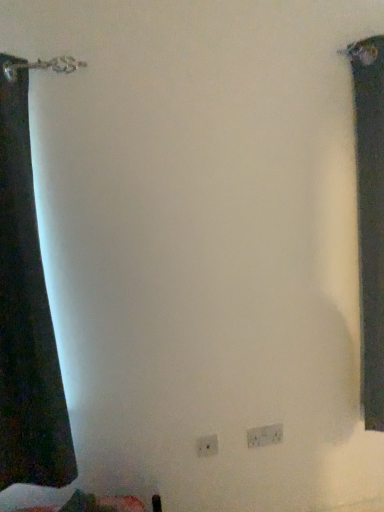
This screenshot has height=512, width=384. Describe the element at coordinates (370, 219) in the screenshot. I see `dark fabric curtain at right` at that location.

What do you see at coordinates (207, 445) in the screenshot?
I see `white plastic electric outlet at lower center, the first electric outlet from the front` at bounding box center [207, 445].

Identify the location of white plastic electric outlet at lower center, the second electric outlet in the right-to-left sequence. Image resolution: width=384 pixels, height=512 pixels. (207, 445).

This screenshot has height=512, width=384. I want to click on white plastic electric outlet at lower center, placed as the 2th electric outlet when sorted from left to right, so click(265, 435).

This screenshot has width=384, height=512. I want to click on dark fabric curtain at right, so click(370, 219).

From a real-world perspective, is white plastic electric outlet at lower center, the second electric outlet in the right-to-left sequence, on top of white plastic electric outlet at lower center, placed as the 2th electric outlet when sorted from left to right?

Yes, from a real-world perspective, white plastic electric outlet at lower center, the second electric outlet in the right-to-left sequence, is over white plastic electric outlet at lower center, placed as the 2th electric outlet when sorted from left to right

Which is closer, (201, 452) or (263, 432)?

The point (201, 452) is in front.

From the image's perspective, between white plastic electric outlet at lower center, which is the second electric outlet in back-to-front order, and white plastic electric outlet at lower center, which is counted as the first electric outlet, starting from the right, who is located below?

From the image's view, white plastic electric outlet at lower center, which is the second electric outlet in back-to-front order, is below.

What's the angular difference between white plastic electric outlet at lower center, placed as the 2th electric outlet when sorted from left to right, and dark fabric curtain at right's facing directions?

There is a 0.103-degree angle between the facing directions of white plastic electric outlet at lower center, placed as the 2th electric outlet when sorted from left to right, and dark fabric curtain at right.

Which is behind, point (280, 428) or point (381, 428)?

Positioned behind is point (381, 428).

From the image's perspective, is white plastic electric outlet at lower center, which ranks as the 1th electric outlet in back-to-front order, on top of dark fabric curtain at right?

No, from the image's perspective, white plastic electric outlet at lower center, which ranks as the 1th electric outlet in back-to-front order, is not above dark fabric curtain at right.

Is white plastic electric outlet at lower center, which ranks as the 1th electric outlet in back-to-front order, inside or outside of dark fabric curtain at right?

white plastic electric outlet at lower center, which ranks as the 1th electric outlet in back-to-front order, cannot be found inside dark fabric curtain at right.

You are a GUI agent. You are given a task and a screenshot of the screen. Output one action in this format:
    pyautogui.click(x=<x>, y=<y>)
    Task: Click on the electric outlet lying behind the white plastic electric outlet at lower center, which is the second electric outlet in back-to-front order
    The height and width of the screenshot is (512, 384).
    Given the screenshot: What is the action you would take?
    pyautogui.click(x=265, y=435)

Is white plastic electric outlet at lower center, which is counted as the first electric outlet, starting from the right, not close to white plastic electric outlet at lower center, which is the second electric outlet in back-to-front order?

No, there isn't a large distance between white plastic electric outlet at lower center, which is counted as the first electric outlet, starting from the right, and white plastic electric outlet at lower center, which is the second electric outlet in back-to-front order.

Looking at their sizes, would you say white plastic electric outlet at lower center, which is counted as the 2th electric outlet, starting from the front, is wider or thinner than white plastic electric outlet at lower center, the second electric outlet in the right-to-left sequence?

In the image, white plastic electric outlet at lower center, which is counted as the 2th electric outlet, starting from the front, appears to be wider than white plastic electric outlet at lower center, the second electric outlet in the right-to-left sequence.

Is white plastic electric outlet at lower center, placed as the 2th electric outlet when sorted from left to right, smaller than white plastic electric outlet at lower center, the second electric outlet in the right-to-left sequence?

No.

Considering the positions of point (204, 454) and point (367, 193), is point (204, 454) closer or farther from the camera than point (367, 193)?

Point (204, 454) is positioned farther from the camera compared to point (367, 193).

From the image's perspective, is white plastic electric outlet at lower center, the second electric outlet in the right-to-left sequence, under dark fabric curtain at right?

Correct, white plastic electric outlet at lower center, the second electric outlet in the right-to-left sequence, appears lower than dark fabric curtain at right in the image.

Is white plastic electric outlet at lower center, which is the second electric outlet in back-to-front order, taller or shorter than dark fabric curtain at right?

In the image, white plastic electric outlet at lower center, which is the second electric outlet in back-to-front order, appears to be shorter than dark fabric curtain at right.

From the picture: Considering the relative positions of white plastic electric outlet at lower center, the 1th electric outlet when ordered from left to right, and dark fabric curtain at right in the image provided, is white plastic electric outlet at lower center, the 1th electric outlet when ordered from left to right, to the right of dark fabric curtain at right from the viewer's perspective?

In fact, white plastic electric outlet at lower center, the 1th electric outlet when ordered from left to right, is to the left of dark fabric curtain at right.

Does dark fabric curtain at right have a greater height compared to white plastic electric outlet at lower center, which is the second electric outlet in back-to-front order?

Yes.

Considering the positions of objects dark fabric curtain at right and white plastic electric outlet at lower center, which is the second electric outlet in back-to-front order, in the image provided, who is more to the right, dark fabric curtain at right or white plastic electric outlet at lower center, which is the second electric outlet in back-to-front order,?

Positioned to the right is dark fabric curtain at right.

From a real-world perspective, is dark fabric curtain at right under white plastic electric outlet at lower center, which is the second electric outlet in back-to-front order?

No, from a real-world perspective, dark fabric curtain at right is not under white plastic electric outlet at lower center, which is the second electric outlet in back-to-front order.

Is white plastic electric outlet at lower center, the 1th electric outlet when ordered from left to right, a part of dark fabric curtain at right?

No, white plastic electric outlet at lower center, the 1th electric outlet when ordered from left to right, is not surrounded by dark fabric curtain at right.

Find the location of a particular element. The height and width of the screenshot is (512, 384). curtain that is in front of the white plastic electric outlet at lower center, which is counted as the 2th electric outlet, starting from the front is located at coordinates (370, 219).

Which is behind, point (366, 56) or point (257, 428)?

Positioned behind is point (257, 428).

Does dark fabric curtain at right touch white plastic electric outlet at lower center, placed as the 2th electric outlet when sorted from left to right?

dark fabric curtain at right and white plastic electric outlet at lower center, placed as the 2th electric outlet when sorted from left to right, are clearly separated.

Is dark fabric curtain at right not within white plastic electric outlet at lower center, which ranks as the 1th electric outlet in back-to-front order?

That's correct, dark fabric curtain at right is outside of white plastic electric outlet at lower center, which ranks as the 1th electric outlet in back-to-front order.

In the image, there is a white plastic electric outlet at lower center, the first electric outlet from the front. Where is `electric outlet below it (from a real-world perspective)`? This screenshot has width=384, height=512. electric outlet below it (from a real-world perspective) is located at coordinates (265, 435).

Image resolution: width=384 pixels, height=512 pixels. In order to click on the 2nd electric outlet behind the dark fabric curtain at right, counting from the anchor's position in this screenshot , I will do `click(265, 435)`.

Which object lies further to the anchor point dark fabric curtain at right, white plastic electric outlet at lower center, which is the second electric outlet in back-to-front order, or white plastic electric outlet at lower center, placed as the 2th electric outlet when sorted from left to right?

The object further to dark fabric curtain at right is white plastic electric outlet at lower center, which is the second electric outlet in back-to-front order.

In the scene shown: When comparing their distances from white plastic electric outlet at lower center, which is counted as the first electric outlet, starting from the right, does white plastic electric outlet at lower center, which is the second electric outlet in back-to-front order, or dark fabric curtain at right seem closer?

white plastic electric outlet at lower center, which is the second electric outlet in back-to-front order, is positioned closer to the anchor white plastic electric outlet at lower center, which is counted as the first electric outlet, starting from the right.

Based on their spatial positions, is dark fabric curtain at right or white plastic electric outlet at lower center, which is counted as the 2th electric outlet, starting from the front, closer to white plastic electric outlet at lower center, the second electric outlet in the right-to-left sequence?

The object closer to white plastic electric outlet at lower center, the second electric outlet in the right-to-left sequence, is white plastic electric outlet at lower center, which is counted as the 2th electric outlet, starting from the front.

Estimate the real-world distances between objects in this image. Which object is closer to white plastic electric outlet at lower center, which ranks as the 1th electric outlet in back-to-front order, dark fabric curtain at right or white plastic electric outlet at lower center, the first electric outlet from the front?

white plastic electric outlet at lower center, the first electric outlet from the front.

Estimate the real-world distances between objects in this image. Which object is closer to white plastic electric outlet at lower center, the first electric outlet from the front, white plastic electric outlet at lower center, which is counted as the 2th electric outlet, starting from the front, or dark fabric curtain at right?

white plastic electric outlet at lower center, which is counted as the 2th electric outlet, starting from the front, is closer to white plastic electric outlet at lower center, the first electric outlet from the front.

From the picture: From the image, which object appears to be farther from dark fabric curtain at right, white plastic electric outlet at lower center, which ranks as the 1th electric outlet in back-to-front order, or white plastic electric outlet at lower center, which is the second electric outlet in back-to-front order?

Based on the image, white plastic electric outlet at lower center, which is the second electric outlet in back-to-front order, appears to be further to dark fabric curtain at right.

Locate an element on the screen. electric outlet between dark fabric curtain at right and white plastic electric outlet at lower center, which is the second electric outlet in back-to-front order, in the vertical direction is located at coordinates (265, 435).